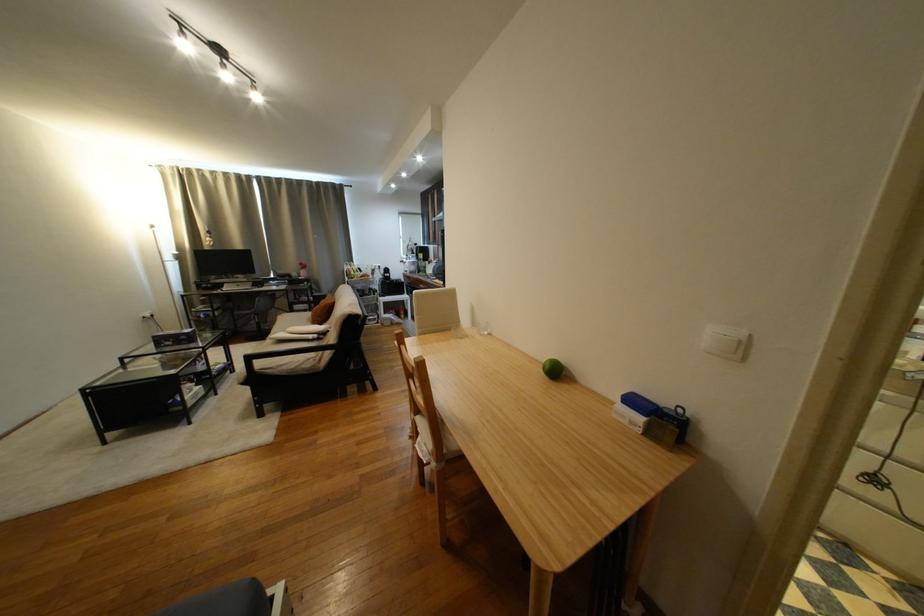
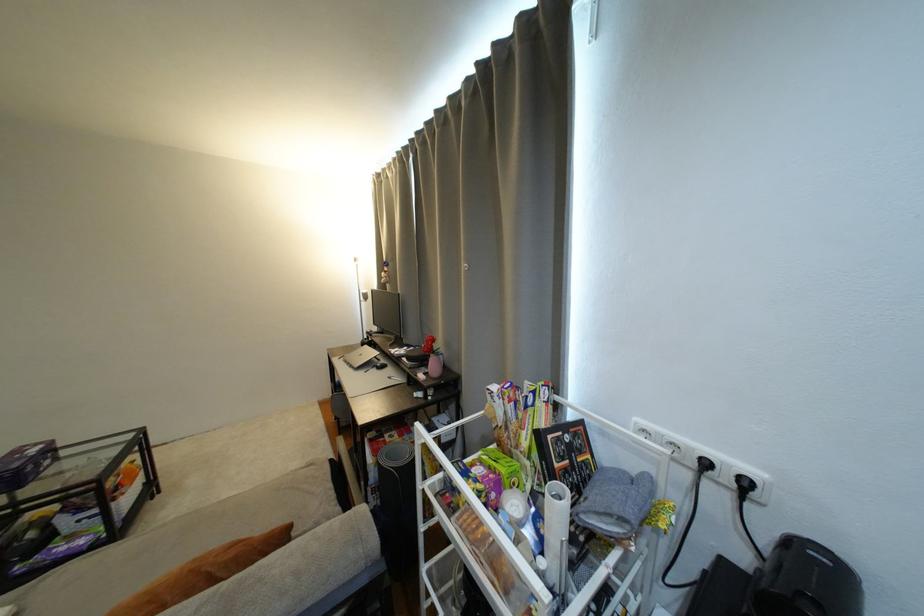
Where in the second image is the point corresponding to the point at 387,268 from the first image?

(754, 485)